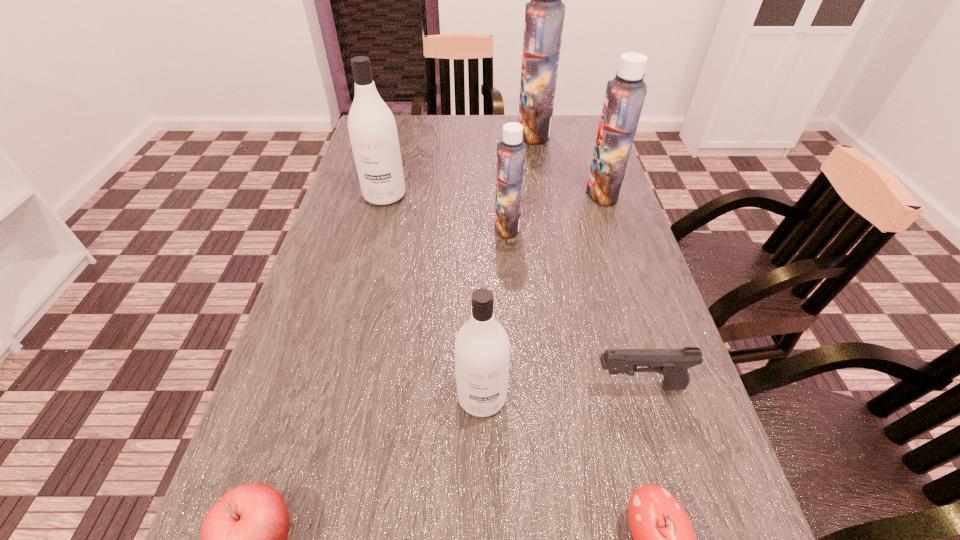
In the image, there is a desktop. Where is `free space at the right edge`? free space at the right edge is located at coordinates (601, 334).

This screenshot has height=540, width=960. In the image, there is a desktop. Identify the location of vacant space at the far left corner. (400, 135).

Identify the location of free location at the far right corner. (585, 121).

Identify the location of vacant space that is in between the leftmost shampoo and the nearest shampoo. (433, 296).

The width and height of the screenshot is (960, 540). I want to click on free space between the leftmost shampoo and the second smallest blue shampoo, so click(493, 193).

Locate an element on the screen. Image resolution: width=960 pixels, height=540 pixels. free space that is in between the rightmost blue shampoo and the leftmost shampoo is located at coordinates (493, 193).

Locate an element on the screen. The height and width of the screenshot is (540, 960). empty space between the bigger white shampoo and the smallest blue shampoo is located at coordinates (446, 211).

Select which object is the fourth closest to the biggest blue shampoo. Please provide its 2D coordinates. Your answer should be formatted as a tuple, i.e. [(x, y)], where the tuple contains the x and y coordinates of a point satisfying the conditions above.

[(482, 349)]

The height and width of the screenshot is (540, 960). Find the location of `object that ranks as the sixth closest to the second smallest blue shampoo`. object that ranks as the sixth closest to the second smallest blue shampoo is located at coordinates (664, 539).

Choose which shampoo is the nearest neighbor to the right apple. Please provide its 2D coordinates. Your answer should be formatted as a tuple, i.e. [(x, y)], where the tuple contains the x and y coordinates of a point satisfying the conditions above.

[(482, 349)]